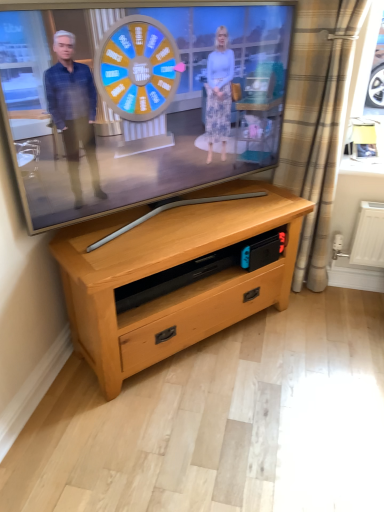
Where is `vacant area in front of light wood chest of drawers at center`? This screenshot has height=512, width=384. vacant area in front of light wood chest of drawers at center is located at coordinates (203, 429).